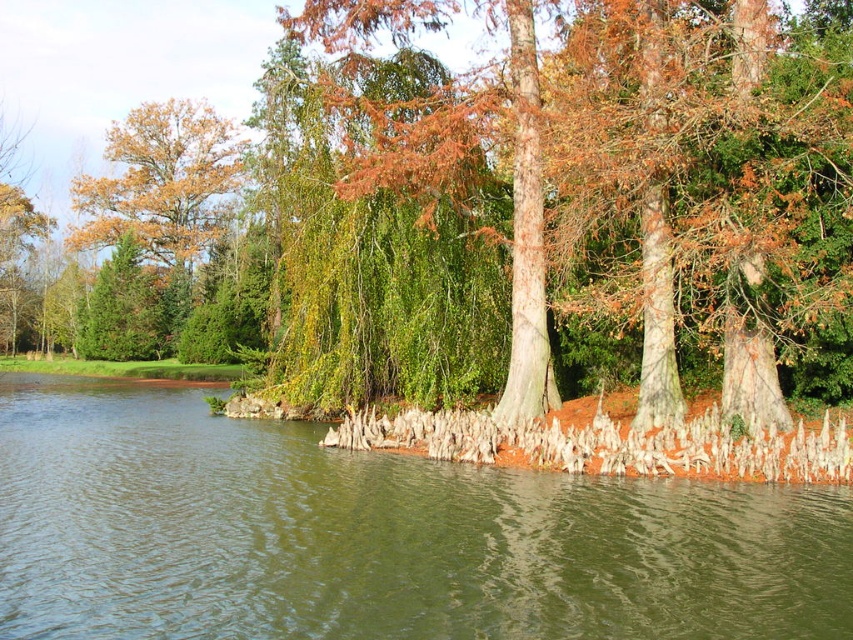
Who is taller, smooth bark tree at center or golden oak tree at upper left?

smooth bark tree at center

Where is `smooth bark tree at center`? The height and width of the screenshot is (640, 853). smooth bark tree at center is located at coordinates (115, 74).

Between green smooth water at center and smooth bark tree at center, which one is positioned lower?

Positioned lower is green smooth water at center.

Is point (260, 614) closer to camera compared to point (25, 145)?

Yes, it is in front of point (25, 145).

This screenshot has width=853, height=640. I want to click on green smooth water at center, so click(x=376, y=536).

Can you confirm if green smooth water at center is smaller than golden oak tree at upper left?

Correct, green smooth water at center occupies less space than golden oak tree at upper left.

Between green smooth water at center and golden oak tree at upper left, which one is positioned higher?

golden oak tree at upper left is above.

Which is in front, point (225, 474) or point (169, 141)?

Positioned in front is point (225, 474).

Identify the location of green smooth water at center. Image resolution: width=853 pixels, height=640 pixels. (376, 536).